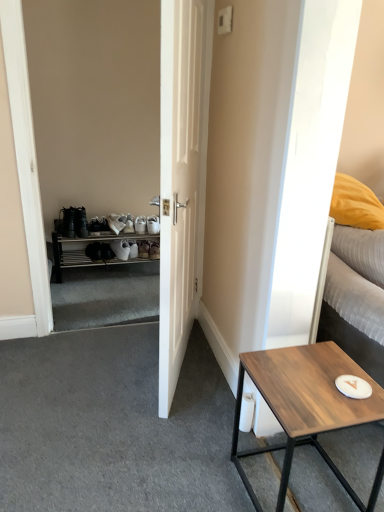
Find the location of `blank space situated above white plastic shoe rack at left (from a real-world perspective)`. blank space situated above white plastic shoe rack at left (from a real-world perspective) is located at coordinates (110, 221).